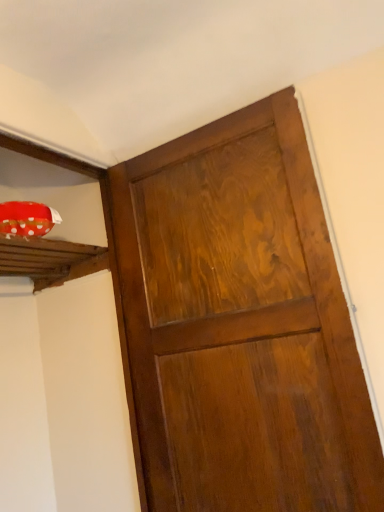
Question: Does wooden plank at upper left have a greater height compared to glossy wood door at center?

Choices:
 (A) no
 (B) yes

Answer: (A)

Question: Does wooden plank at upper left appear on the left side of glossy wood door at center?

Choices:
 (A) yes
 (B) no

Answer: (A)

Question: Is wooden plank at upper left far away from glossy wood door at center?

Choices:
 (A) no
 (B) yes

Answer: (A)

Question: Is the position of wooden plank at upper left more distant than that of glossy wood door at center?

Choices:
 (A) yes
 (B) no

Answer: (A)

Question: From the image's perspective, is wooden plank at upper left above glossy wood door at center?

Choices:
 (A) yes
 (B) no

Answer: (A)

Question: Does wooden plank at upper left appear on the right side of glossy wood door at center?

Choices:
 (A) no
 (B) yes

Answer: (A)

Question: Is glossy wood door at center to the right of wooden plank at upper left from the viewer's perspective?

Choices:
 (A) no
 (B) yes

Answer: (B)

Question: Can you confirm if glossy wood door at center is taller than wooden plank at upper left?

Choices:
 (A) no
 (B) yes

Answer: (B)

Question: Is glossy wood door at center far away from wooden plank at upper left?

Choices:
 (A) no
 (B) yes

Answer: (A)

Question: Is glossy wood door at center completely or partially outside of wooden plank at upper left?

Choices:
 (A) no
 (B) yes

Answer: (B)

Question: Is wooden plank at upper left at the back of glossy wood door at center?

Choices:
 (A) yes
 (B) no

Answer: (B)

Question: From a real-world perspective, is glossy wood door at center on top of wooden plank at upper left?

Choices:
 (A) yes
 (B) no

Answer: (B)

Question: Which is correct: wooden plank at upper left is inside glossy wood door at center, or outside of it?

Choices:
 (A) outside
 (B) inside

Answer: (A)